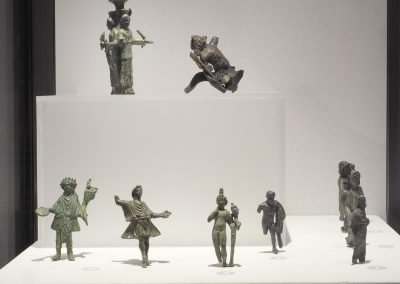
Locate an element on the screen. three figurines in a line is located at coordinates (358, 217), (349, 190), (342, 181).